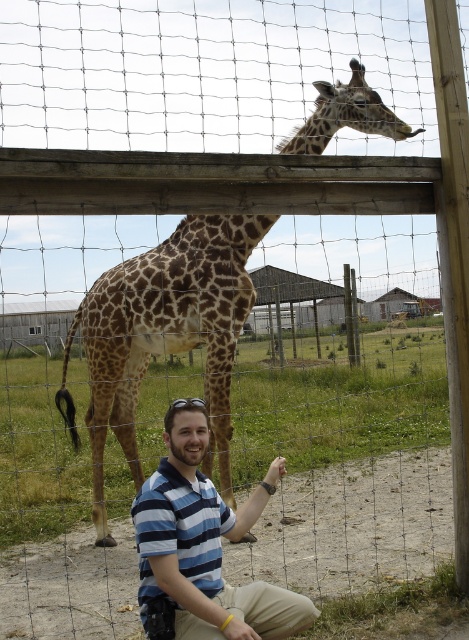
Question: Does spotted brown giraffe at upper center appear over blue striped shirt at lower center?

Choices:
 (A) yes
 (B) no

Answer: (A)

Question: In this image, where is spotted brown giraffe at upper center located relative to blue striped shirt at lower center?

Choices:
 (A) left
 (B) right

Answer: (A)

Question: Which of the following is the farthest from the observer?

Choices:
 (A) blue striped shirt at lower center
 (B) spotted brown giraffe at upper center

Answer: (B)

Question: Does spotted brown giraffe at upper center appear on the right side of blue striped shirt at lower center?

Choices:
 (A) no
 (B) yes

Answer: (A)

Question: Which point is farther from the camera taking this photo?

Choices:
 (A) (242, 609)
 (B) (74, 440)

Answer: (B)